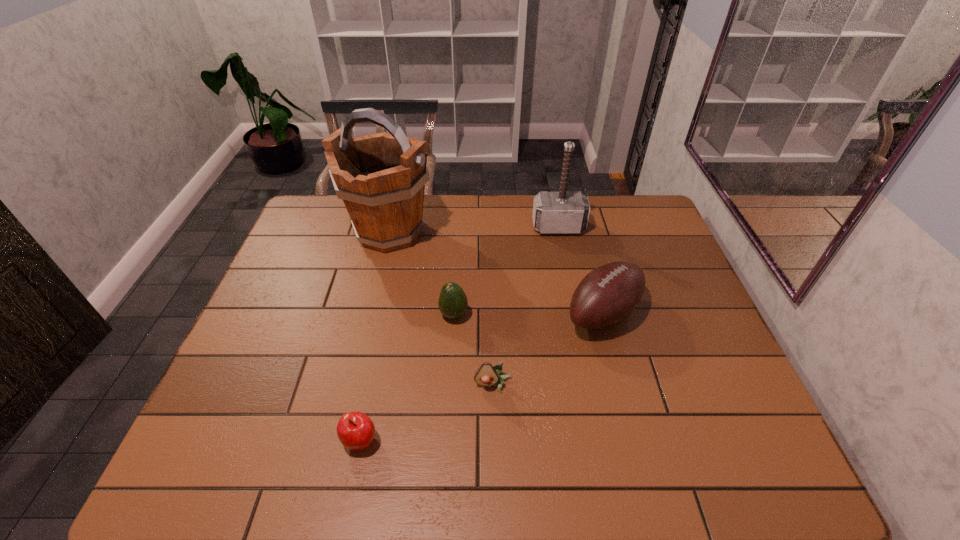
Where is `vacant space located on the right of the football (American)`? This screenshot has height=540, width=960. vacant space located on the right of the football (American) is located at coordinates click(668, 313).

The height and width of the screenshot is (540, 960). I want to click on vacant space situated on the right of the third shortest object, so click(x=584, y=315).

Where is `free space located on the seed side of the nearer avocado`? This screenshot has width=960, height=540. free space located on the seed side of the nearer avocado is located at coordinates (495, 460).

Identify the location of vacant area situated 0.400m on the back of the apple. (390, 296).

This screenshot has height=540, width=960. What are the coordinates of `bucket that is at the far edge` in the screenshot? It's located at (381, 178).

Find the location of `hammer positioned at the far edge`. hammer positioned at the far edge is located at coordinates (562, 212).

What are the coordinates of `object at the near edge` in the screenshot? It's located at (356, 431).

At what (x,y) coordinates should I click in order to perform the action: click on free space at the far edge of the desktop. Please return your answer as a coordinate pair (x, y). Looking at the image, I should click on (466, 232).

Where is `vacant space at the left edge`? vacant space at the left edge is located at coordinates (302, 249).

Locate an element on the screen. vacant region at the right edge of the desktop is located at coordinates (673, 309).